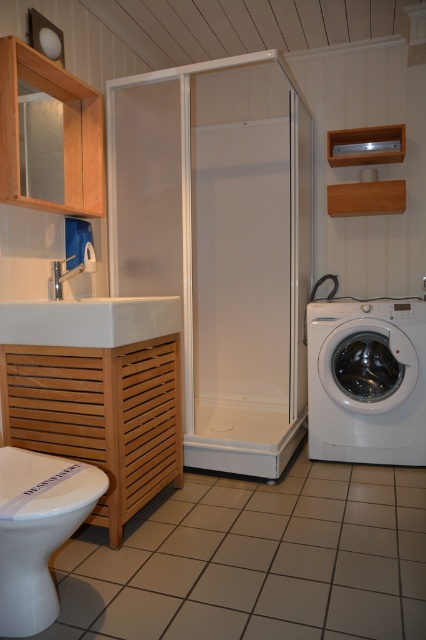
Between white glossy toilet bowl at lower left and white glossy sink at left, which one is positioned higher?

white glossy sink at left is higher up.

Is white glossy toilet bowl at lower left positioned in front of white glossy sink at left?

Yes, it is in front of white glossy sink at left.

Does point (34, 579) come farther from viewer compared to point (62, 337)?

No, (34, 579) is in front of (62, 337).

The width and height of the screenshot is (426, 640). I want to click on white glossy toilet bowl at lower left, so click(x=37, y=531).

Looking at this image, does transparent glass shower door at center have a greater width compared to white glossy washing machine at lower right?

Yes.

Does transparent glass shower door at center have a larger size compared to white glossy washing machine at lower right?

Indeed, transparent glass shower door at center has a larger size compared to white glossy washing machine at lower right.

Which is behind, point (296, 168) or point (322, 321)?

Point (322, 321)

This screenshot has height=640, width=426. In order to click on transparent glass shower door at center in this screenshot , I will do `click(221, 243)`.

Between point (422, 436) and point (11, 515), which one is positioned in front?

Point (11, 515) is in front.

Is white glossy washing machine at lower right to the left of white glossy toilet bowl at lower left from the viewer's perspective?

In fact, white glossy washing machine at lower right is to the right of white glossy toilet bowl at lower left.

Between point (362, 330) and point (13, 548), which one is positioned behind?

Positioned behind is point (362, 330).

The width and height of the screenshot is (426, 640). In order to click on white glossy washing machine at lower right in this screenshot , I will do `click(367, 380)`.